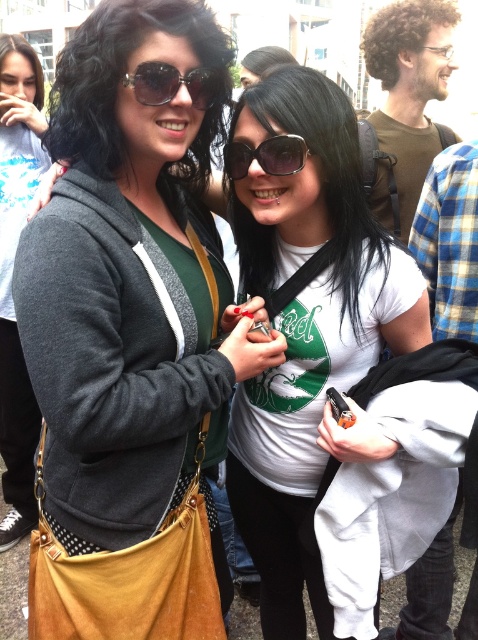
You are standing at the center of the image and want to pick up either the matte black hoodie at center or the matte black jacket at center. Which item is closer to your current position?

Both the matte black hoodie at center and the matte black jacket at center are at the same distance from your current position since they are both located at the center of the image.